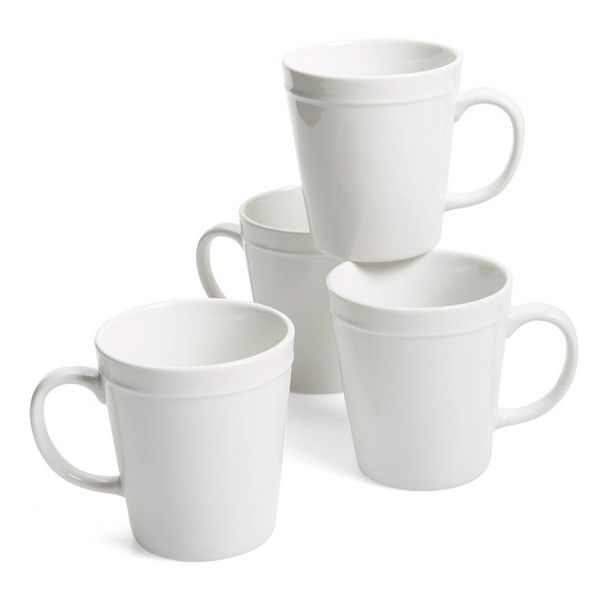
I want to click on mug handles, so click(x=79, y=379), click(x=198, y=254), click(x=554, y=323), click(x=491, y=196).